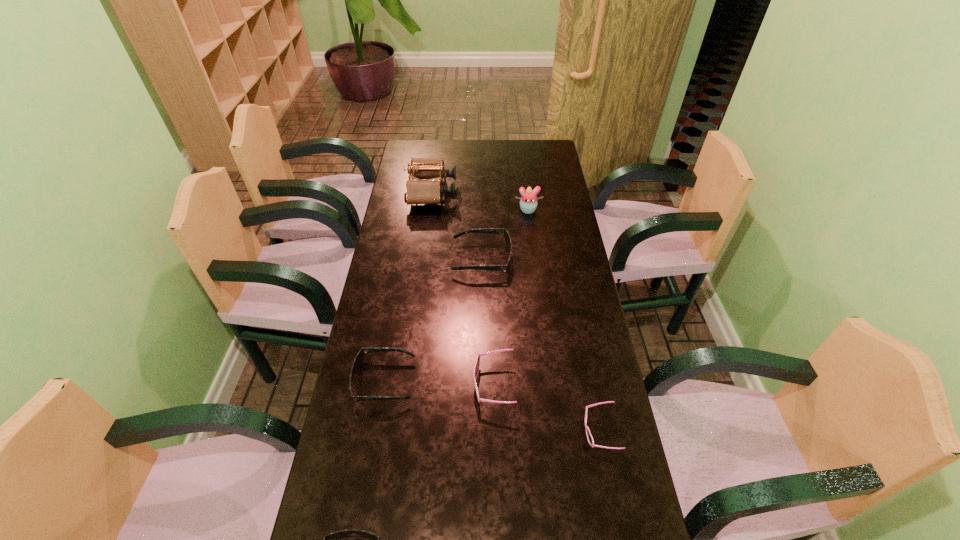
You are a GUI agent. You are given a task and a screenshot of the screen. Output one action in this format:
    pyautogui.click(x=<x>, y=<y>)
    Task: Click on the blank region between the left pink sunglasses and the second biggest black sunglasses
    The width and height of the screenshot is (960, 540).
    Given the screenshot: What is the action you would take?
    pyautogui.click(x=439, y=383)

Identify the location of free spot between the farthest sunglasses and the rightmost object. (540, 346).

This screenshot has height=540, width=960. What are the coordinates of `empty space between the second farthest black sunglasses and the rightmost object` in the screenshot? It's located at (492, 406).

Locate an element on the screen. This screenshot has width=960, height=540. vacant point located between the smaller pink sunglasses and the bigger pink sunglasses is located at coordinates (546, 408).

At what (x,y) coordinates should I click in order to perform the action: click on vacant space that is in between the second nearest black sunglasses and the bigger pink sunglasses. Please return your answer as a coordinate pair (x, y). The height and width of the screenshot is (540, 960). Looking at the image, I should click on (439, 383).

Where is `blank region between the second biggest black sunglasses and the fifth nearest object`? This screenshot has width=960, height=540. blank region between the second biggest black sunglasses and the fifth nearest object is located at coordinates (433, 320).

Locate an element on the screen. object that stands as the second closest to the rightmost black sunglasses is located at coordinates (418, 191).

Where is `object that ranks as the fifth closest to the second biggest black sunglasses`? This screenshot has height=540, width=960. object that ranks as the fifth closest to the second biggest black sunglasses is located at coordinates (418, 191).

Locate an element on the screen. The image size is (960, 540). sunglasses that can be found as the closest to the nearest object is located at coordinates (358, 360).

Find the location of `sunglasses that is the closest to the second biggest black sunglasses`. sunglasses that is the closest to the second biggest black sunglasses is located at coordinates (476, 368).